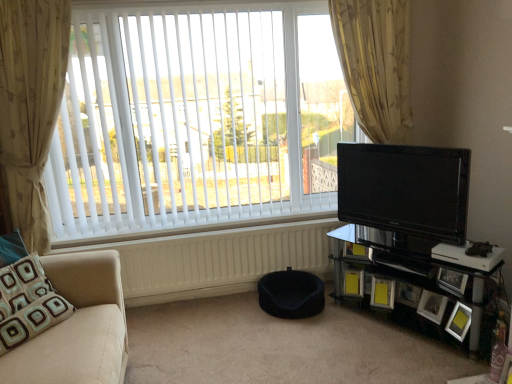
Find the location of a particular element. free location in front of black glass entertainment center at lower right is located at coordinates (417, 357).